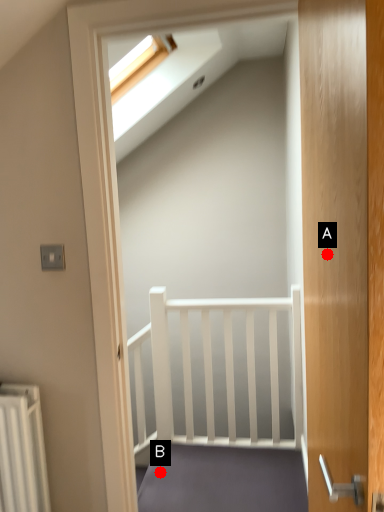
Question: Two points are circled on the image, labeled by A and B beside each circle. Which point is farther to the camera?

Choices:
 (A) A is further
 (B) B is further

Answer: (B)